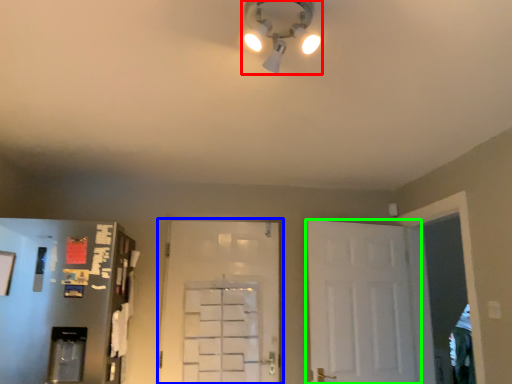
Question: Considering the real-world distances, which object is closest to light fixture (highlighted by a red box)? door (highlighted by a blue box) or door (highlighted by a green box).

Choices:
 (A) door
 (B) door

Answer: (B)